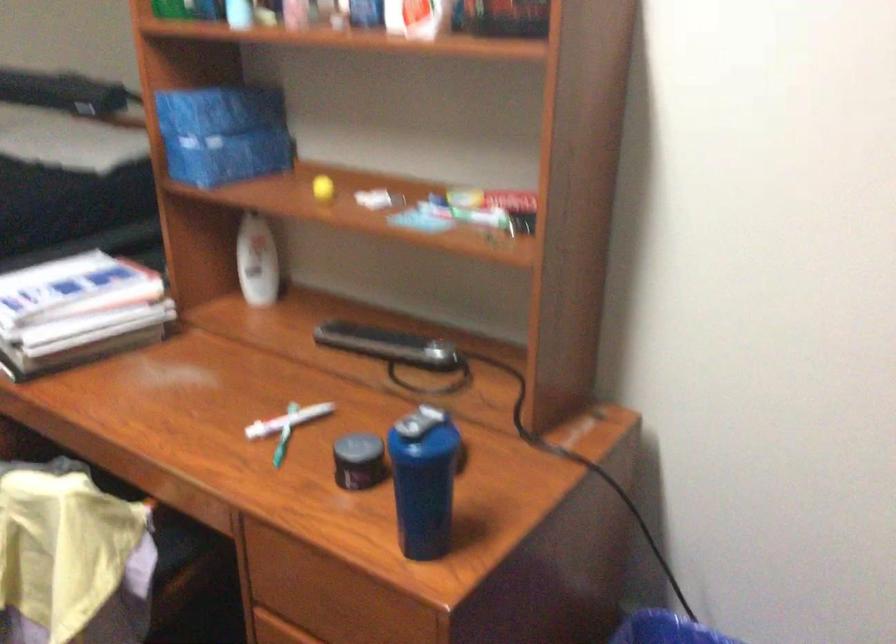
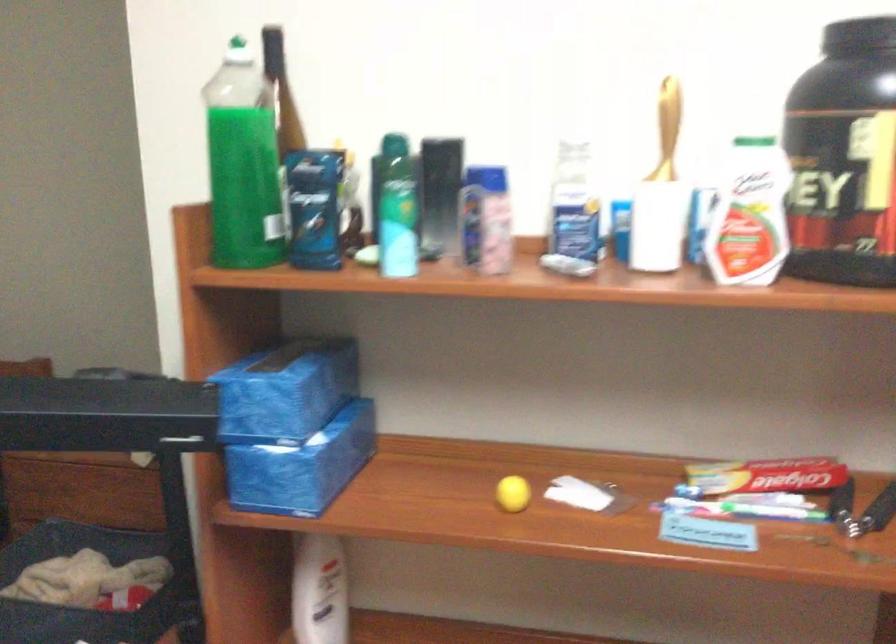
Locate, in the second image, the point that corresponds to (192,99) in the first image.

(286, 391)